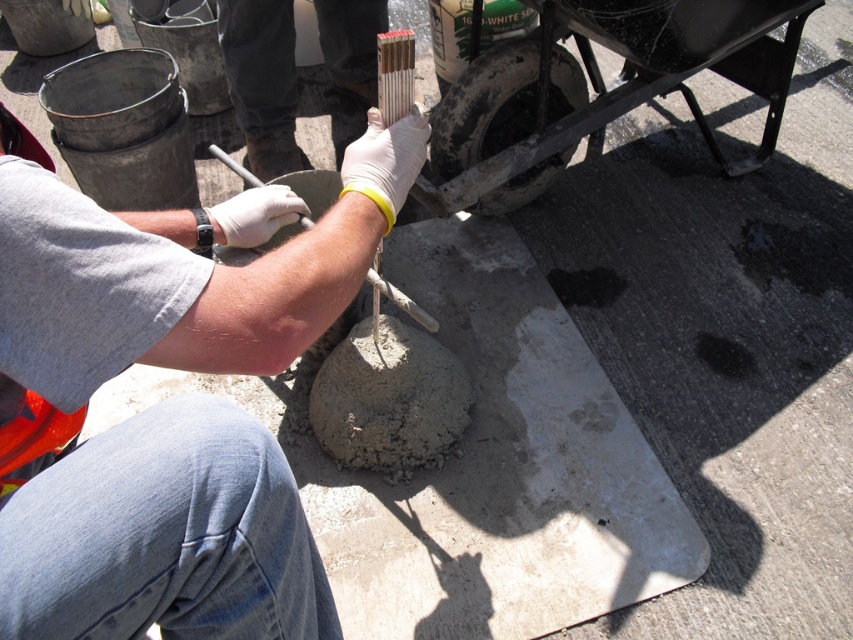
Can you confirm if white matte gloves at center is positioned above white rubber shovel at center?

No.

Is white matte gloves at center to the left of white rubber shovel at center from the viewer's perspective?

Indeed, white matte gloves at center is positioned on the left side of white rubber shovel at center.

Which is in front, point (289, 218) or point (227, 154)?

Point (289, 218) is more forward.

The height and width of the screenshot is (640, 853). I want to click on white matte gloves at center, so click(x=167, y=401).